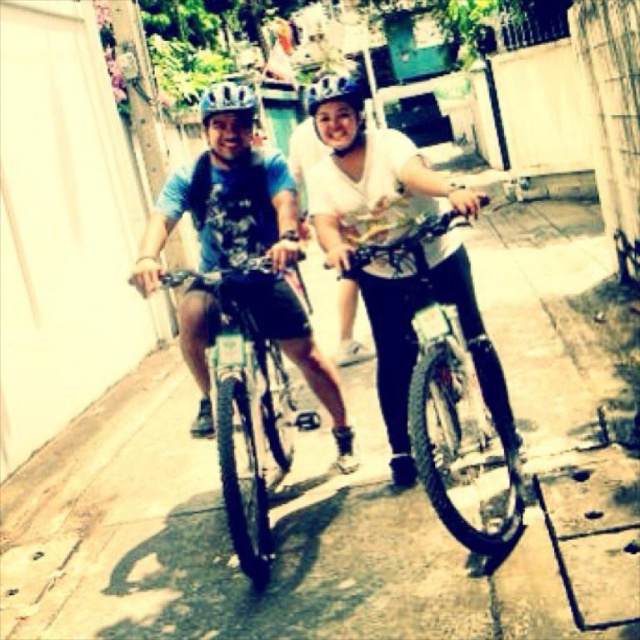
You are a cyclist riding a bicycle that is 1.2 meters wide. You come across a narrow alleyway where the shiny metallic bicycle at center and the matte black helmet at center are positioned. Can your bicycle pass through the space between them without touching either object?

The shiny metallic bicycle at center is below the matte black helmet at center, so there is vertical space between them. Since your bicycle is 1.2 meters wide and the vertical space is likely sufficient, your bicycle can pass through the space between them without touching either object.

You are a delivery rider who needs to quickly pass through a narrow alleyway. You see a shiny metallic bicycle at center and a matte black helmet at center. Which object is shorter in height?

The shiny metallic bicycle at center has a lesser height compared to the matte black helmet at center, so the shiny metallic bicycle at center is shorter in height.

You are a delivery person who needs to ride through a narrow alley that is only 1.2 meters wide. You see the shiny metallic bicycle at center and the matte black helmet at center in the image. Can your bicycle, which is 1.1 meters wide, fit through the alley without touching the walls?

The shiny metallic bicycle at center has a lesser width compared to matte black helmet at center. However, the width of the bicycle itself is not provided. Therefore, it is impossible to determine if it can fit through the 1.2 meter alley.